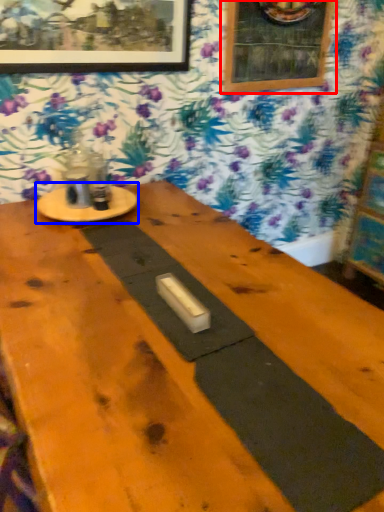
Question: Which point is further to the camera, picture frame (highlighted by a red box) or round table (highlighted by a blue box)?

Choices:
 (A) picture frame
 (B) round table

Answer: (A)